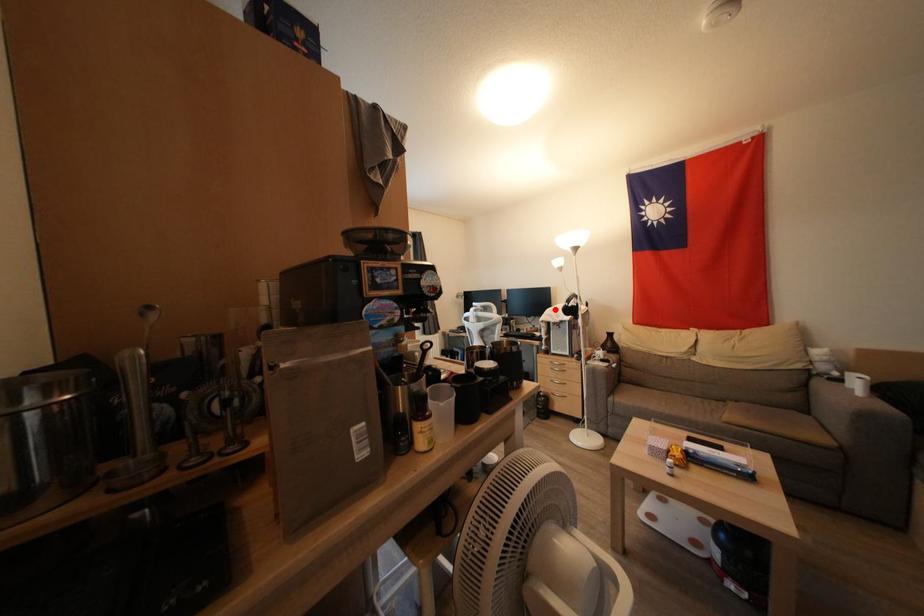
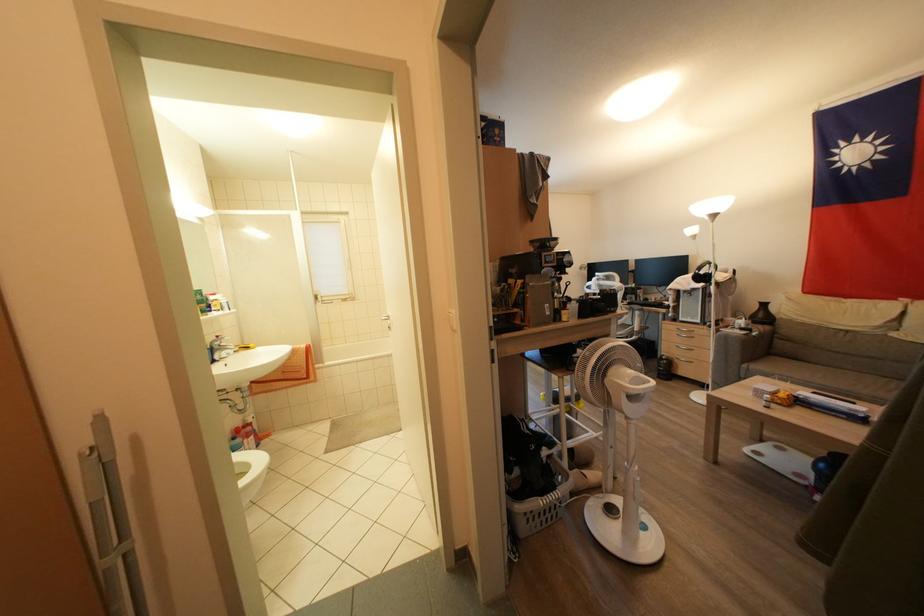
Question: A red point is marked in image1. In image2, is the corresponding 3D point closer to the camera or farther? Reply with the corresponding letter.

Choices:
 (A) The corresponding 3D point is closer.
 (B) The corresponding 3D point is farther.

Answer: (A)